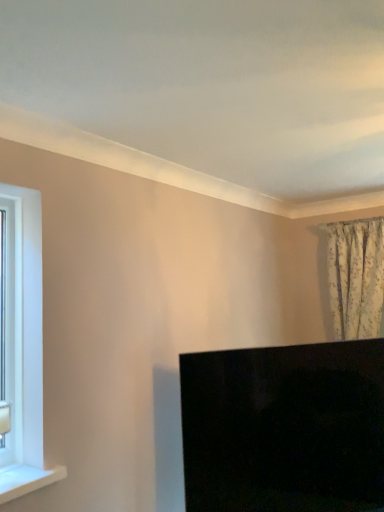
Question: From the image's perspective, is white glossy window sill at lower left located above or below black glossy monitor at lower right?

Choices:
 (A) above
 (B) below

Answer: (A)

Question: Would you say white glossy window sill at lower left is inside or outside black glossy monitor at lower right?

Choices:
 (A) inside
 (B) outside

Answer: (B)

Question: Which of these objects is positioned farthest from the floral fabric curtain at upper right?

Choices:
 (A) white plastic window frame at left
 (B) black glossy monitor at lower right
 (C) white glossy window sill at lower left

Answer: (A)

Question: Estimate the real-world distances between objects in this image. Which object is farther from the white plastic window frame at left?

Choices:
 (A) floral fabric curtain at upper right
 (B) black glossy monitor at lower right
 (C) white glossy window sill at lower left

Answer: (A)